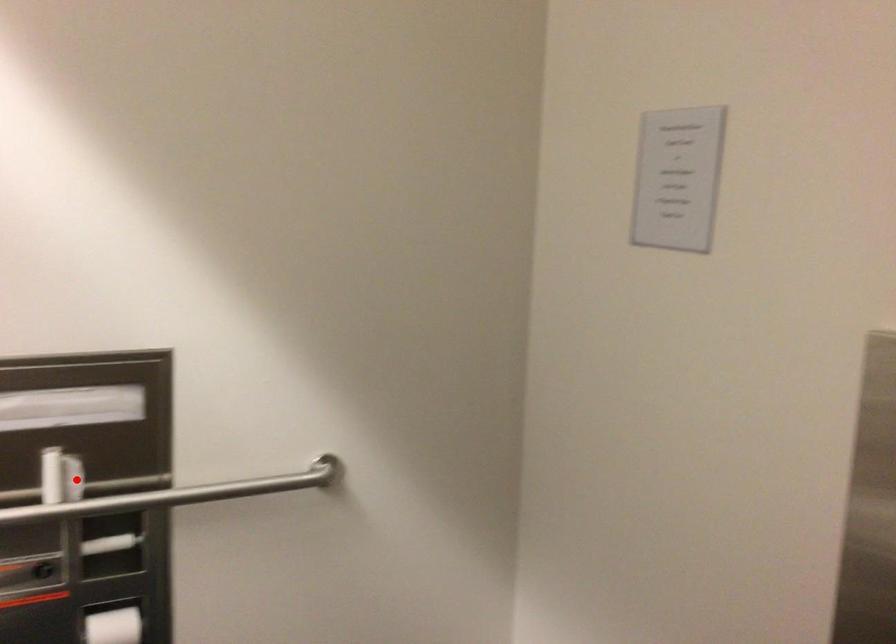
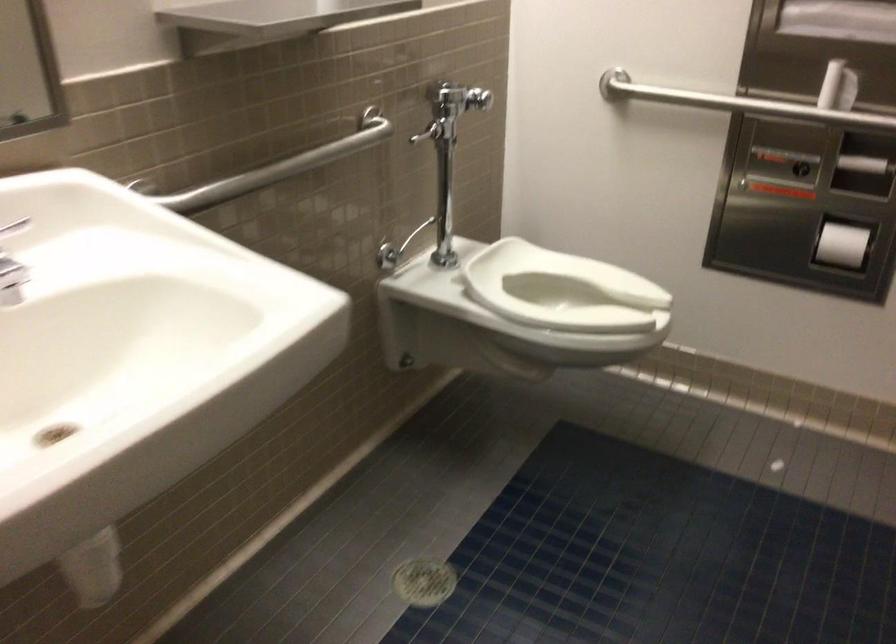
Where in the second image is the point corresponding to the highlighted location from the first image?

(838, 87)